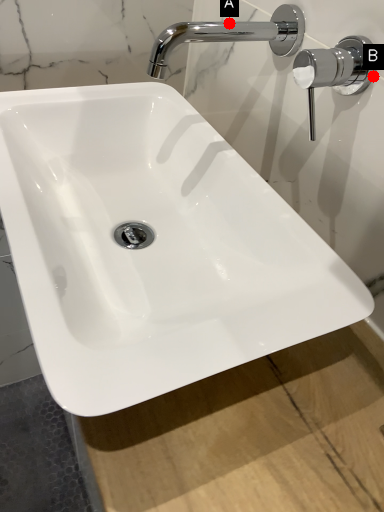
Question: Two points are circled on the image, labeled by A and B beside each circle. Which point is further to the camera?

Choices:
 (A) A is further
 (B) B is further

Answer: (A)